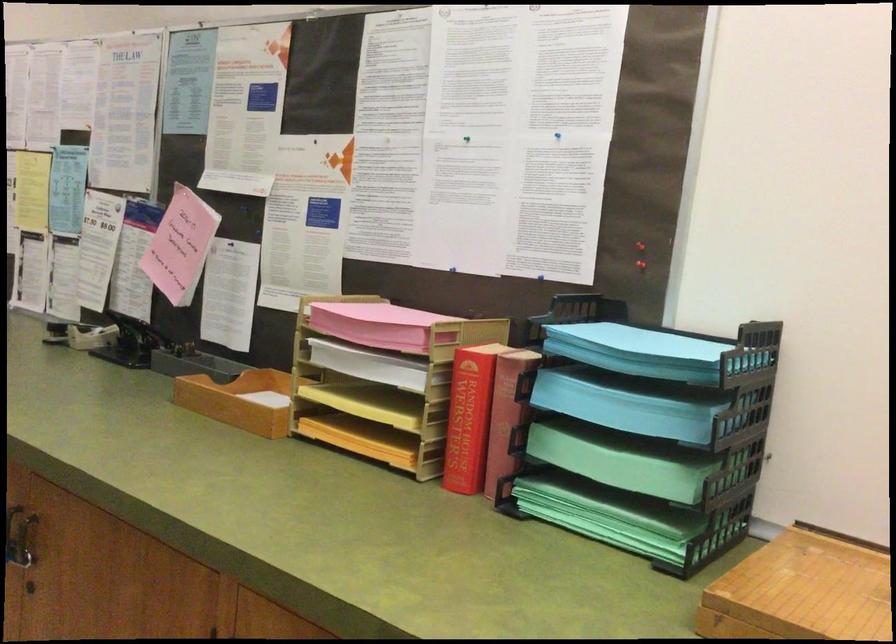
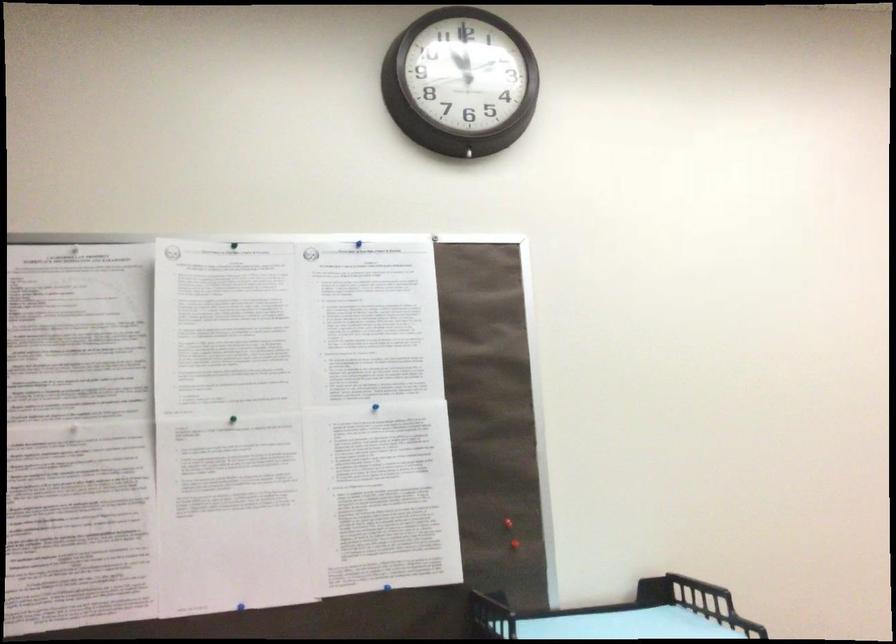
Question: The camera is either moving clockwise (left) or counter-clockwise (right) around the object. The first image is from the beginning of the video and the second image is from the end. Is the camera moving left or right when shooting the video?

Choices:
 (A) Left
 (B) Right

Answer: (A)